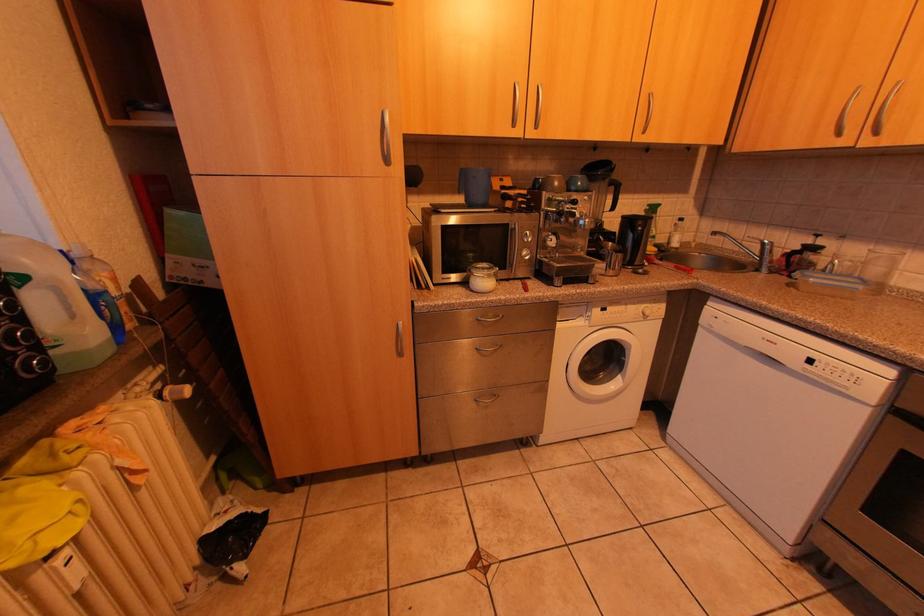
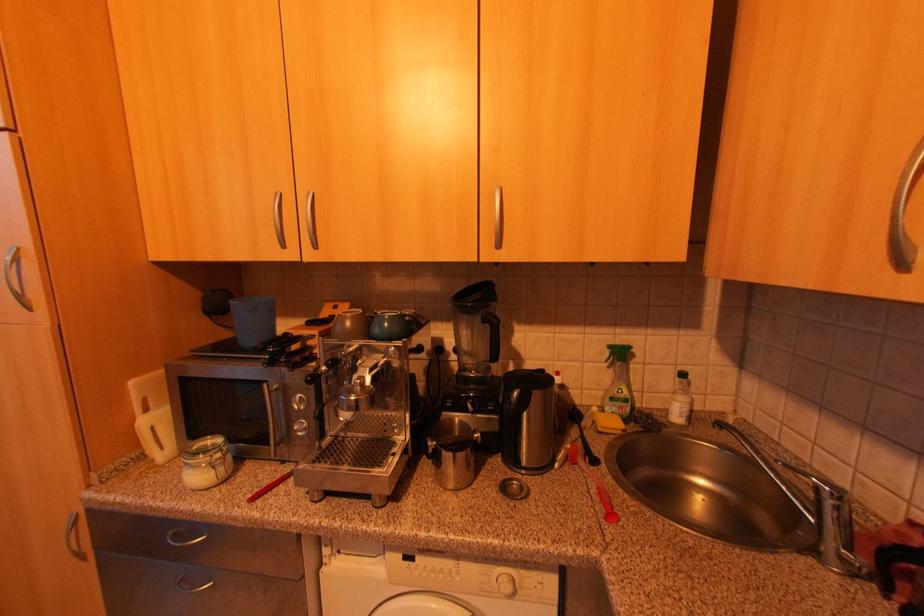
The images are taken continuously from a first-person perspective. In which direction are you moving?

The movement direction of the cameraman is right, forward.